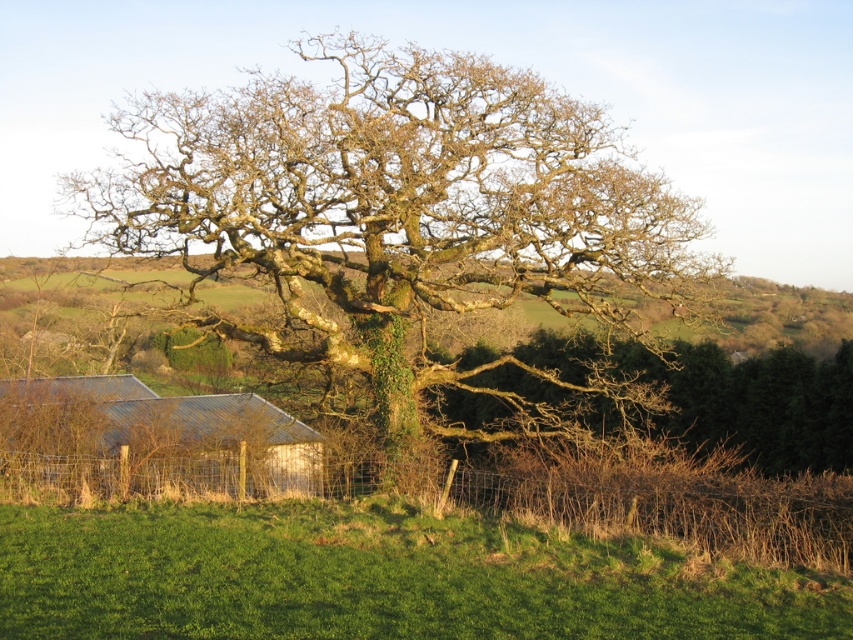
You are standing in the rural landscape and want to take a photo of the green mossy oak at center and the white corrugated metal hut at lower left. Which object should you focus on first if you want both to be in the same frame without moving the camera?

The green mossy oak at center is above the white corrugated metal hut at lower left, so you should focus on the green mossy oak at center first to ensure both are in the frame.

You are standing in front of the large gnarled oak tree in the rural landscape. You notice two points marked on the image at coordinates point (369, 44) and point (166, 621). Which point is closer to your eyes?

Point (369, 44) is further to the camera than point (166, 621), so the closer point to your eyes is point (166, 621).

You are a landscape architect designing a new park. You need to place a 10m wide statue between the green mossy oak at center and the green grassy hill at lower center. Can the space between them accommodate the statue?

The green mossy oak at center is wider than the green grassy hill at lower center. However, the question asks about the space between them accommodating a 10m wide statue. The provided information only compares their widths, not the distance between them. Without knowing the actual distance between the two objects, it is impossible to determine if the statue will fit. Please provide more details about the spacing between the green mossy oak at center and the green grassy hill at lower center.